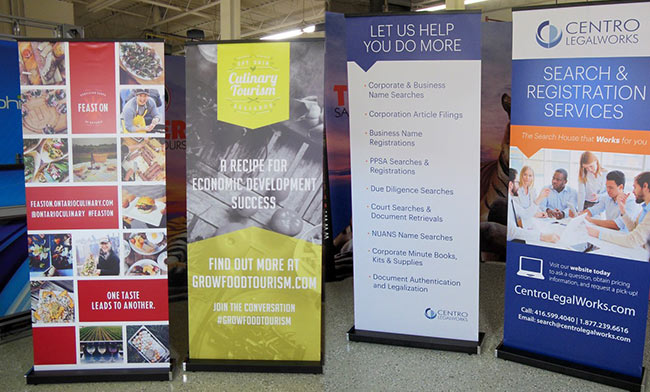
The height and width of the screenshot is (392, 650). I want to click on computer, so click(528, 265).